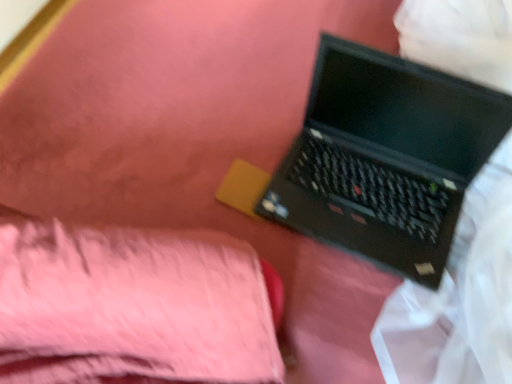
Image resolution: width=512 pixels, height=384 pixels. Describe the element at coordinates (385, 158) in the screenshot. I see `black matte laptop at upper right` at that location.

The height and width of the screenshot is (384, 512). In order to click on black matte laptop at upper right in this screenshot , I will do `click(385, 158)`.

Locate an element on the screen. Image resolution: width=512 pixels, height=384 pixels. black matte laptop at upper right is located at coordinates (385, 158).